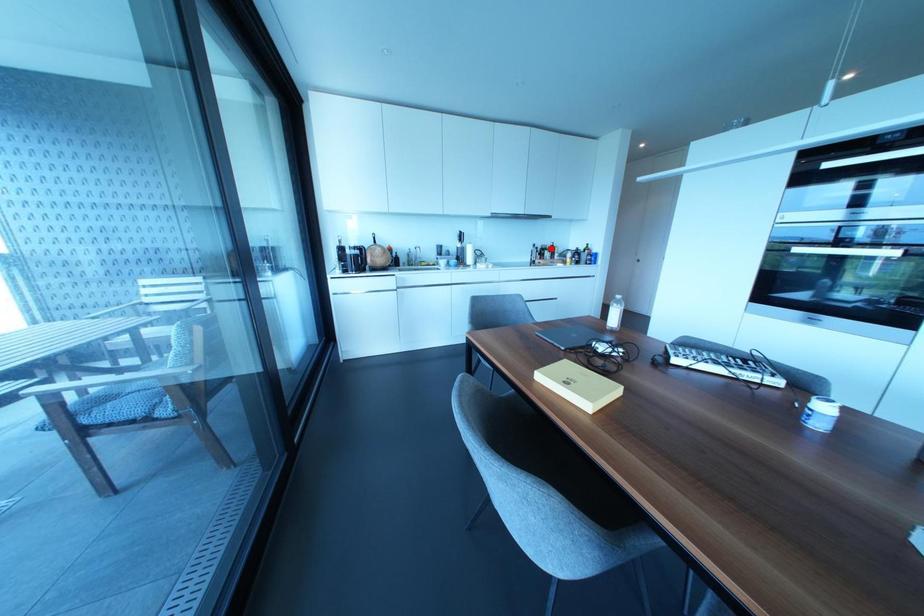
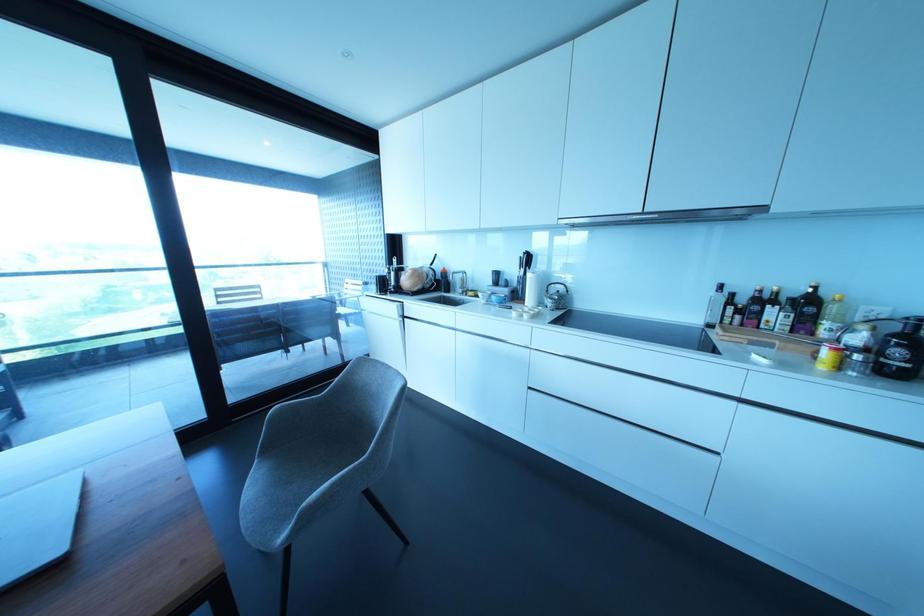
Question: I am providing you with two images of the same scene from different viewpoints. Image1 has a red point marked. In image2, the corresponding 3D location appears at what relative position? Reply with the corresponding letter.

Choices:
 (A) Closer
 (B) Farther

Answer: (B)